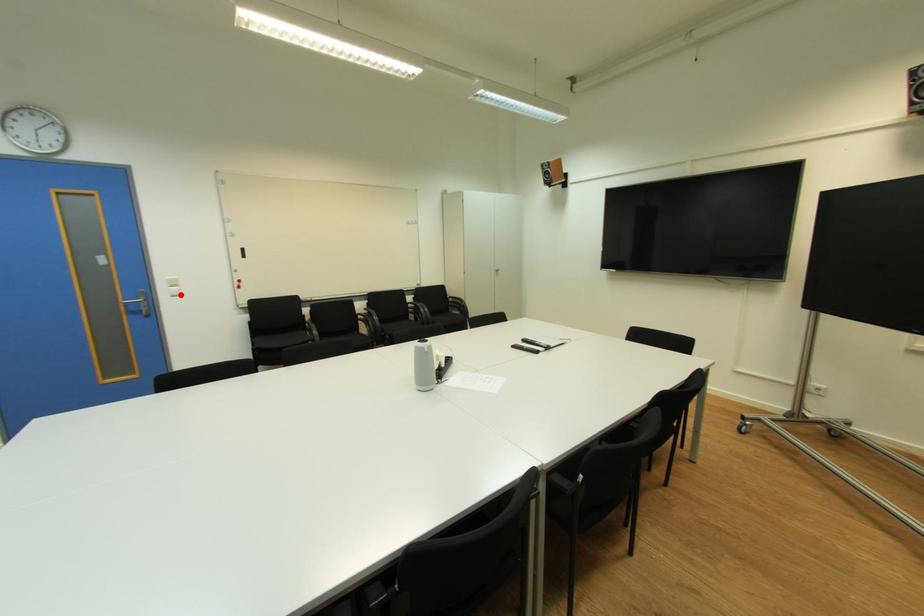
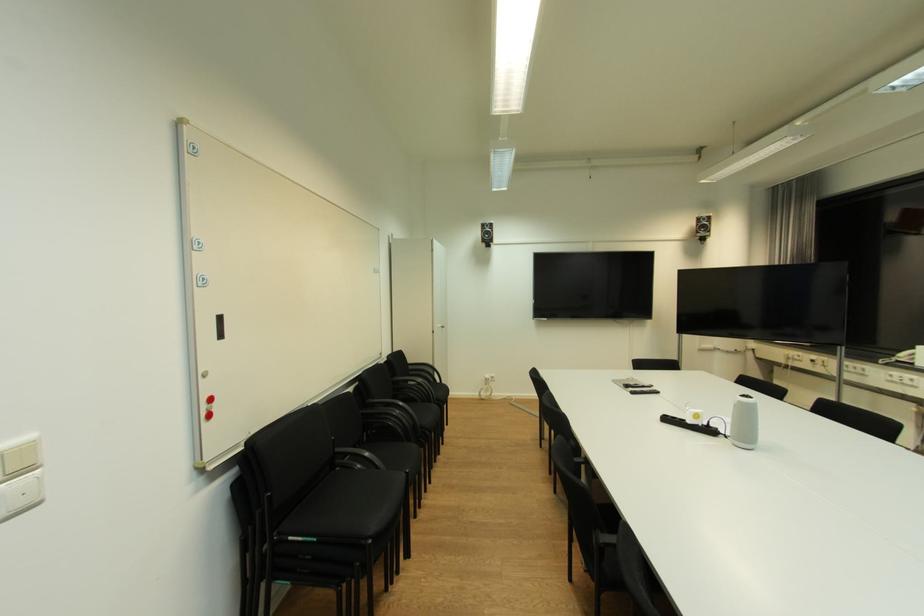
In the second image, find the point that corresponds to the highlighted location in the first image.

(26, 505)